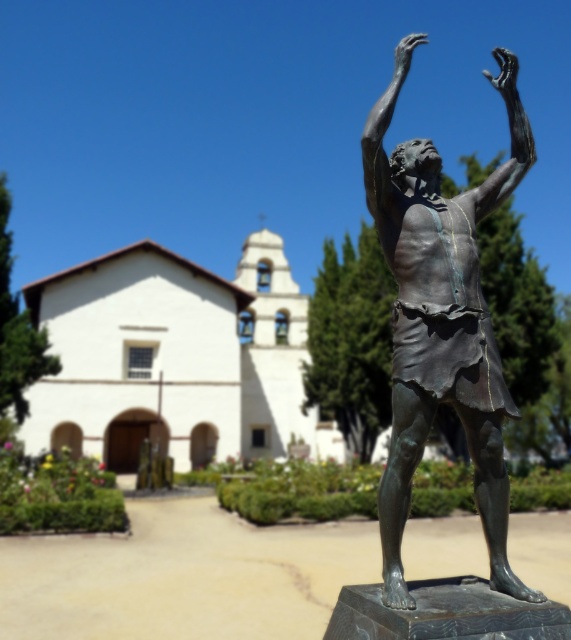
Question: Does white stucco church at center appear under bronze statue at center?

Choices:
 (A) no
 (B) yes

Answer: (B)

Question: Can you confirm if white stucco church at center is thinner than bronze statue at center?

Choices:
 (A) yes
 (B) no

Answer: (B)

Question: Does white stucco church at center have a greater width compared to bronze statue at center?

Choices:
 (A) yes
 (B) no

Answer: (A)

Question: Which object appears farthest from the camera in this image?

Choices:
 (A) bronze statue at center
 (B) white stucco church at center

Answer: (B)